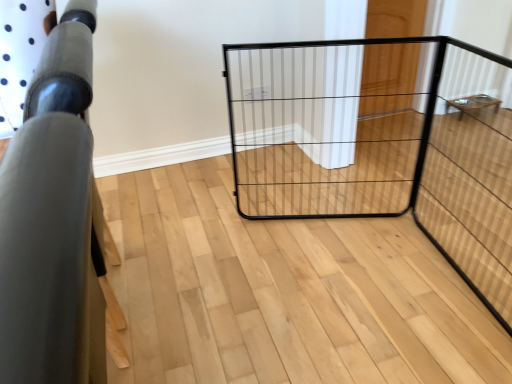
I want to click on free space underneath black wire cage at center (from a real-world perspective), so (x=353, y=222).